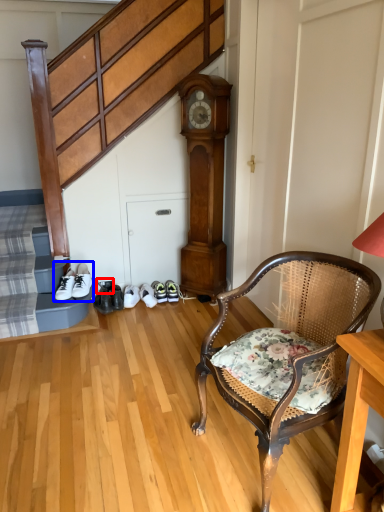
Question: Among these objects, which one is farthest to the camera, shoe (highlighted by a red box) or footwear (highlighted by a blue box)?

Choices:
 (A) shoe
 (B) footwear

Answer: (A)